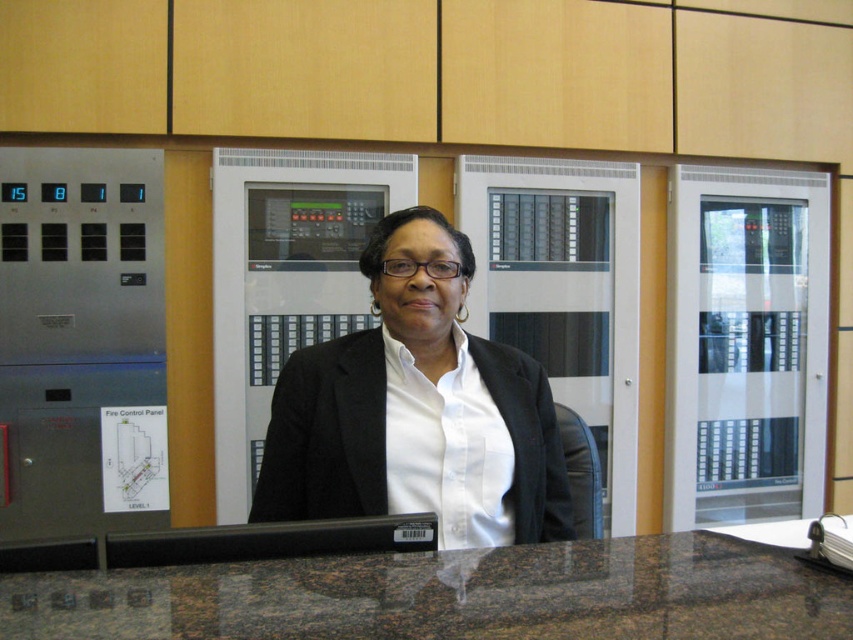
You are a maintenance worker who needs to place a tool box on the brown granite table at center. Considering the height of the white matte blazer at center, will the tool box be visible from above the table?

The brown granite table at center is not as tall as the white matte blazer at center, so the tool box placed on the table will be visible from above since the table is shorter than the blazer.

You are standing in a control room and see a point marked at coordinates (450,595). Based on the scene description, what object is located at that point?

The point at coordinates (450,595) corresponds to the brown granite table at center.

You are an engineer inspecting control panels in the room. You see two points marked on the panels. Which point is closer to you, point at coordinates [561,611] or point at coordinates [454,492]?

Point at coordinates [561,611] is closer to the viewer than point at coordinates [454,492].